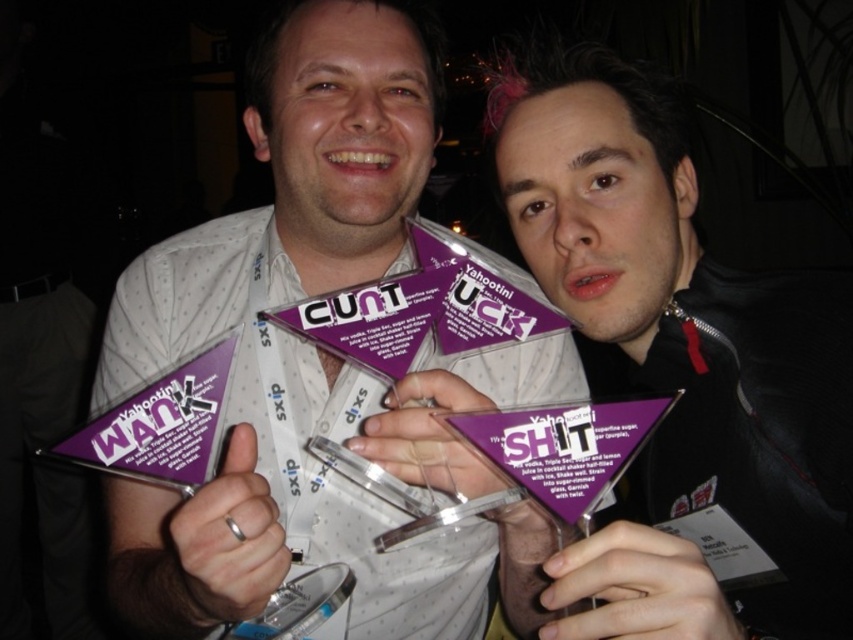
From the picture: You are at a party and see two awards displayed on a table. The first is a purple glossy triangle at center, and the second is a purple paper award at center. Which award is placed higher on the table?

The purple paper award at center is placed higher on the table than the purple glossy triangle at center.

You are at a party and see two awards displayed on a table. There is a purple glossy triangle at center and a purple paper award at center. Which award is positioned to the left?

The purple glossy triangle at center is positioned to the left of the purple paper award at center.